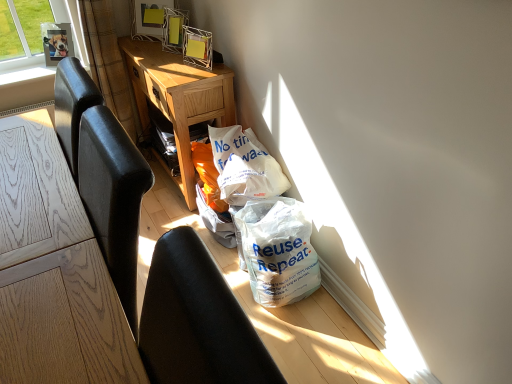
Identify the location of vacant space in front of metallic silver picture frame at upper left, acting as the 1th picture frame starting from the left. This screenshot has height=384, width=512. (53, 79).